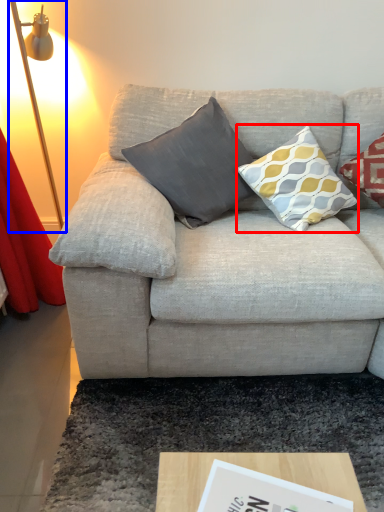
Question: Which point is further to the camera, pillow (highlighted by a red box) or table lamp (highlighted by a blue box)?

Choices:
 (A) pillow
 (B) table lamp

Answer: (A)